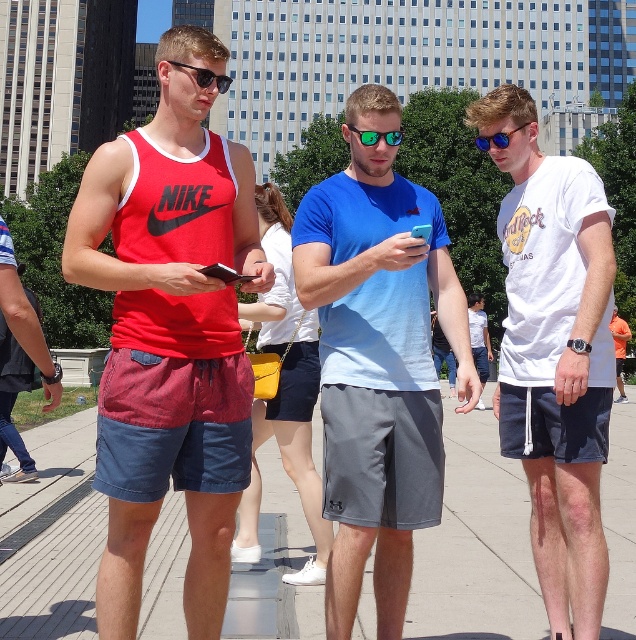
You are standing on the concrete pavement at center and want to hand a document to the person wearing the blue cotton shirt at center. In which direction should you move to reach them?

The blue cotton shirt at center is to the right of the concrete pavement at center, so you should move to your right to reach the person wearing the blue cotton shirt at center.

You are a delivery drone operator. Your drone is currently hovering 10 feet above the concrete pavement at center. You need to deliver a package to the green reflective sunglasses at center. Is the drone within the required 20 feet delivery radius to make the drop?

The distance between the concrete pavement at center and the green reflective sunglasses at center is 21.12 feet. Since the drone is hovering 10 feet above the concrete pavement, the total distance to the sunglasses would be 10 feet plus 21.12 feet, totaling 31.12 feet. This exceeds the required 20 feet delivery radius, so the drone cannot make the drop.

You are a photographer trying to capture a photo of the two points in the image. The first point is at coordinate point (x=380, y=324) and the second point is at coordinate point (x=506, y=584). Since you want to focus on the point closer to you, which coordinate should you aim your camera at?

The point closer to the camera is point (x=380, y=324), so you should aim your camera at that coordinate.